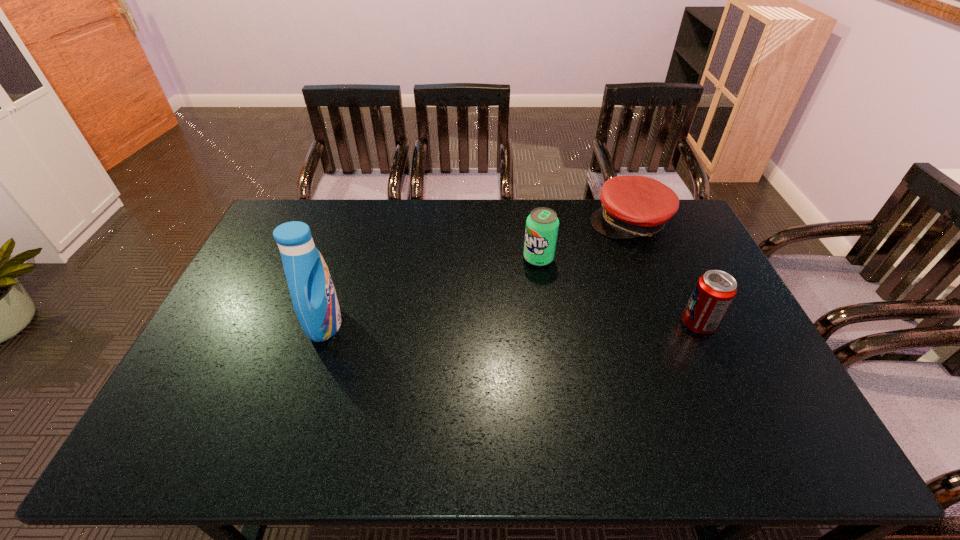
Where is `vacant space located on the front-facing side of the second farthest object`? This screenshot has height=540, width=960. vacant space located on the front-facing side of the second farthest object is located at coordinates (522, 278).

Locate an element on the screen. This screenshot has width=960, height=540. free space located on the front-facing side of the second farthest object is located at coordinates (481, 326).

The image size is (960, 540). Identify the location of free point located 0.070m at the front of the cap where the visor is located. (607, 253).

In order to click on free spot located at the front of the cap where the visor is located in this screenshot , I will do pos(607,253).

You are a GUI agent. You are given a task and a screenshot of the screen. Output one action in this format:
    pyautogui.click(x=<x>, y=<y>)
    Task: Click on the free space located at the front of the cap where the visor is located
    
    Given the screenshot: What is the action you would take?
    pyautogui.click(x=571, y=303)

At what (x,y) coordinates should I click in order to perform the action: click on object that is at the far edge. Please return your answer as a coordinate pair (x, y). Looking at the image, I should click on (633, 206).

Locate an element on the screen. This screenshot has width=960, height=540. soda can that is at the right edge is located at coordinates (715, 290).

The width and height of the screenshot is (960, 540). I want to click on cap positioned at the right edge, so click(x=633, y=206).

Locate an element on the screen. This screenshot has width=960, height=540. object located at the far right corner is located at coordinates (633, 206).

In the image, there is a desktop. At what (x,y) coordinates should I click in order to perform the action: click on vacant space at the far edge. Please return your answer as a coordinate pair (x, y). The height and width of the screenshot is (540, 960). Looking at the image, I should click on (560, 235).